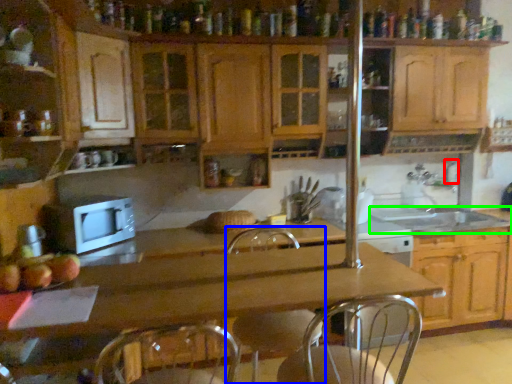
Question: Which object is positioned closest to faucet (highlighted by a red box)? Select from swivel chair (highlighted by a blue box) and sink (highlighted by a green box).

Choices:
 (A) swivel chair
 (B) sink

Answer: (B)